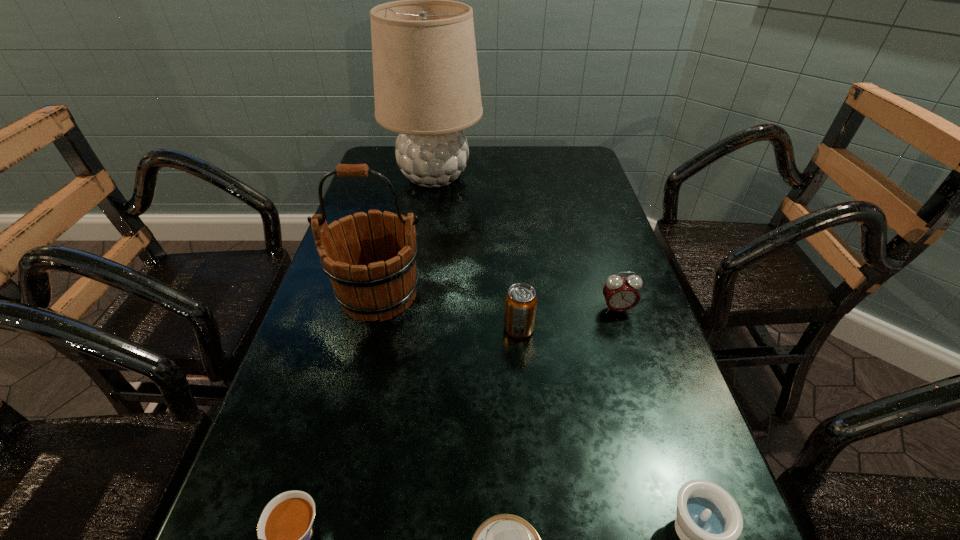
The width and height of the screenshot is (960, 540). What are the coordinates of `vacant area that lies between the sixth shortest object and the alarm clock` in the screenshot? It's located at (498, 302).

At what (x,y) coordinates should I click in order to perform the action: click on vacant area that lies between the alarm clock and the farthest object. Please return your answer as a coordinate pair (x, y). This screenshot has height=540, width=960. Looking at the image, I should click on (525, 243).

Locate an element on the screen. the sixth closest object to the second tallest object is located at coordinates (709, 522).

Identify the location of object that is the fourth closest to the alarm clock. (505, 539).

Choose which teacup is the second nearest neighbor to the soda can. Please provide its 2D coordinates. Your answer should be formatted as a tuple, i.e. [(x, y)], where the tuple contains the x and y coordinates of a point satisfying the conditions above.

[(709, 522)]

You are a GUI agent. You are given a task and a screenshot of the screen. Output one action in this format:
    pyautogui.click(x=<x>, y=<y>)
    Task: Click on the teacup that stands as the closest to the second shortest teacup
    The image size is (960, 540).
    Given the screenshot: What is the action you would take?
    pyautogui.click(x=505, y=539)

Find the location of a particular element. The width and height of the screenshot is (960, 540). free space that satisfies the following two spatial constraints: 1. on the front side of the soda can; 2. on the right side of the tallest object is located at coordinates (x=411, y=329).